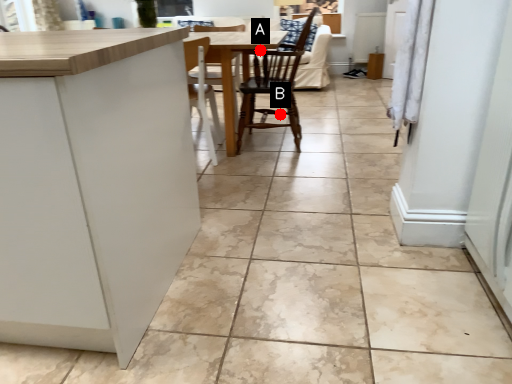
Question: Two points are circled on the image, labeled by A and B beside each circle. Which point is further to the camera?

Choices:
 (A) A is further
 (B) B is further

Answer: (B)